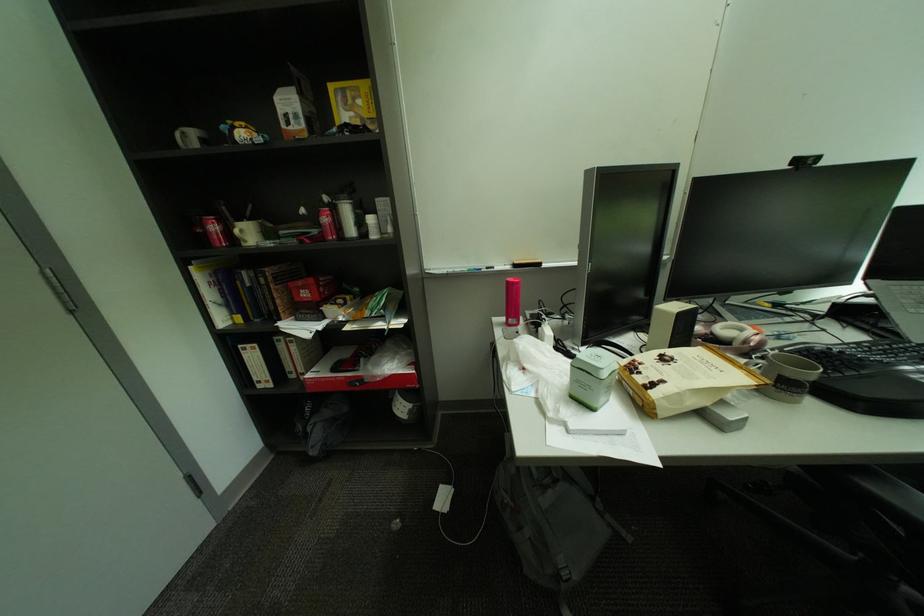
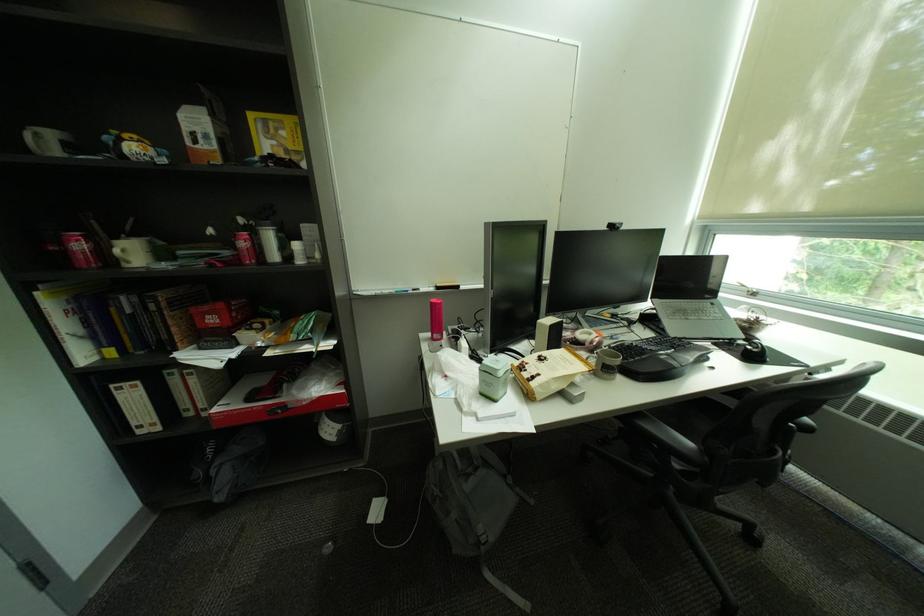
The point at [341,212] is marked in the first image. Where is the corresponding point in the second image?

(260, 236)